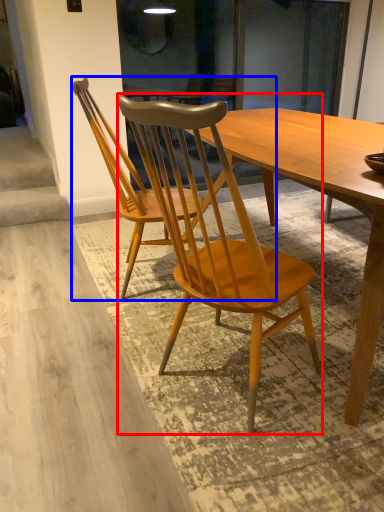
Question: Which of the following is the farthest to the observer, chair (highlighted by a red box) or chair (highlighted by a blue box)?

Choices:
 (A) chair
 (B) chair

Answer: (B)